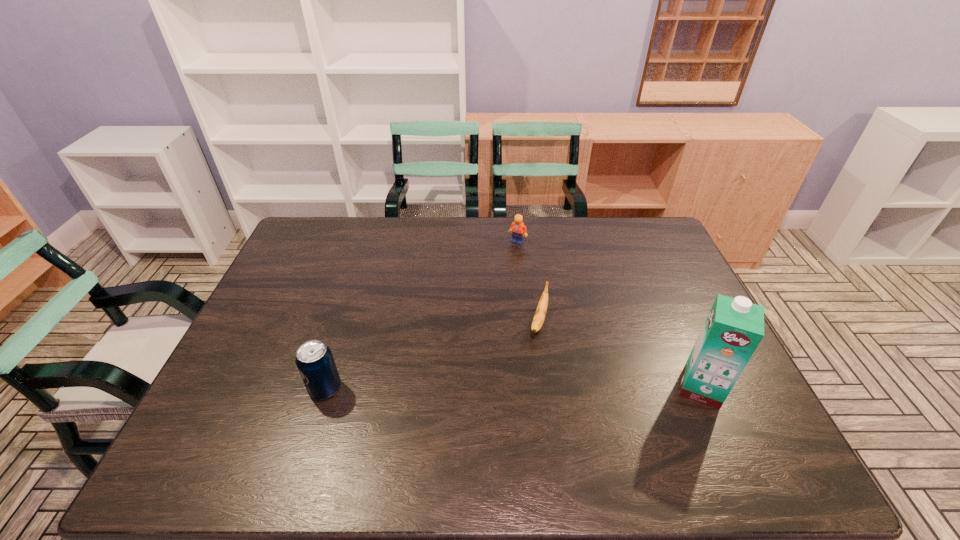
This screenshot has width=960, height=540. What are the coordinates of `object present at the near right corner` in the screenshot? It's located at (734, 327).

Identify the location of free region at the far edge of the desktop. Image resolution: width=960 pixels, height=540 pixels. (470, 222).

Where is `vacant space at the near edge`? Image resolution: width=960 pixels, height=540 pixels. vacant space at the near edge is located at coordinates (299, 411).

Image resolution: width=960 pixels, height=540 pixels. I want to click on free space at the left edge, so click(273, 298).

The width and height of the screenshot is (960, 540). What are the coordinates of `vacant region at the right edge of the desktop` in the screenshot? It's located at (678, 290).

This screenshot has height=540, width=960. In the image, there is a desktop. In order to click on free space at the far left corner in this screenshot , I will do `click(319, 234)`.

This screenshot has width=960, height=540. Find the location of `free space at the far right corner of the desktop`. free space at the far right corner of the desktop is located at coordinates tap(641, 222).

Where is `empty space between the carton and the second farthest object`? The image size is (960, 540). empty space between the carton and the second farthest object is located at coordinates (620, 354).

Locate an element on the screen. This screenshot has width=960, height=540. free spot between the rightmost object and the banana is located at coordinates (620, 354).

Image resolution: width=960 pixels, height=540 pixels. I want to click on free area in between the third shortest object and the carton, so click(513, 388).